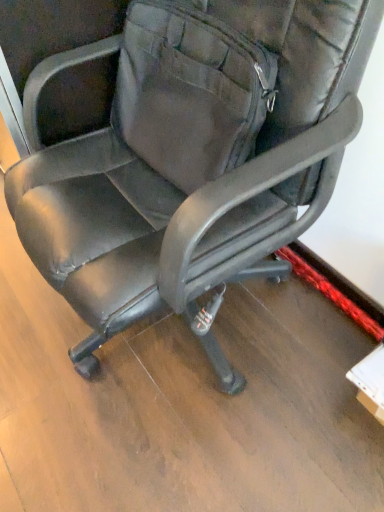
Question: Should I look upward or downward to see camouflage fabric messenger bag at center?

Choices:
 (A) up
 (B) down

Answer: (A)